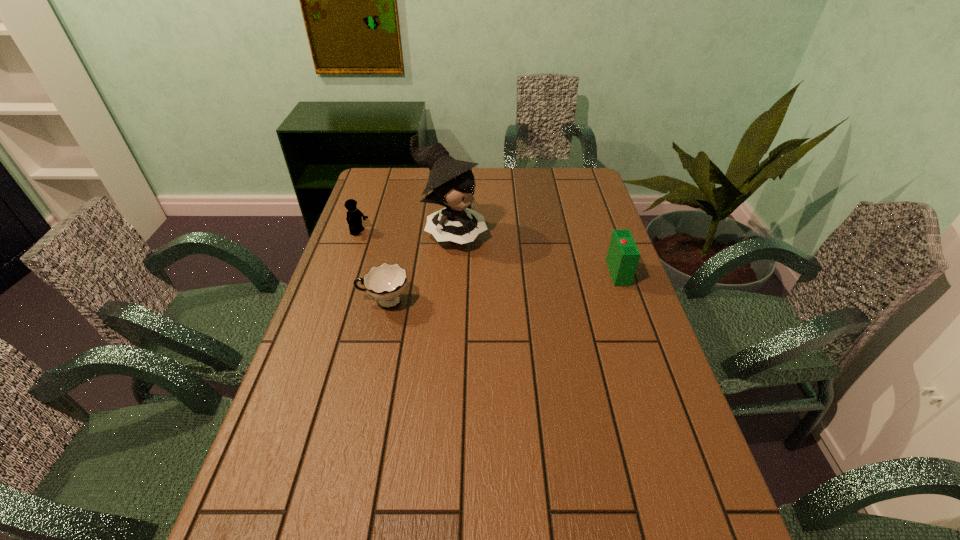
Where is `free space on the desktop that is between the shortest object and the alarm clock and is positioned on the front-facing side of the Lego`? free space on the desktop that is between the shortest object and the alarm clock and is positioned on the front-facing side of the Lego is located at coordinates (498, 287).

Locate an element on the screen. The height and width of the screenshot is (540, 960). free space on the desktop that is between the cup and the rightmost object and is positioned at the face of the tallest object is located at coordinates (540, 282).